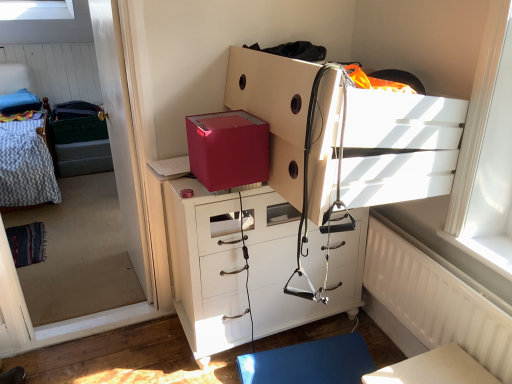
Question: Looking at the image, does blue rubber yoga mat at lower center seem bigger or smaller compared to white glossy table at lower right?

Choices:
 (A) big
 (B) small

Answer: (B)

Question: From a real-world perspective, is blue rubber yoga mat at lower center above or below white glossy table at lower right?

Choices:
 (A) above
 (B) below

Answer: (B)

Question: Based on their relative distances, which object is nearer to the blue rubber yoga mat at lower center?

Choices:
 (A) matte red shoe box at center
 (B) white glossy table at lower right
 (C) textured fabric hospital bed at left
 (D) transparent glass window screen at left
 (E) white glossy chest of drawers at center, placed as the first chest of drawers when sorted from bottom to top

Answer: (E)

Question: Estimate the real-world distances between objects in this image. Which object is closer to the textured fabric hospital bed at left?

Choices:
 (A) white textured radiator at lower right
 (B) matte white chest of drawers at center, positioned as the first chest of drawers in top-to-bottom order
 (C) blue rubber yoga mat at lower center
 (D) white glossy chest of drawers at center, placed as the first chest of drawers when sorted from bottom to top
 (E) matte red shoe box at center

Answer: (D)